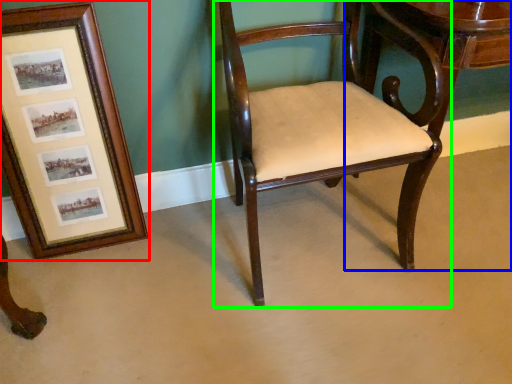
Question: Based on their relative distances, which object is nearer to picture frame (highlighted by a red box)? Choose from table (highlighted by a blue box) and chair (highlighted by a green box).

Choices:
 (A) table
 (B) chair

Answer: (B)